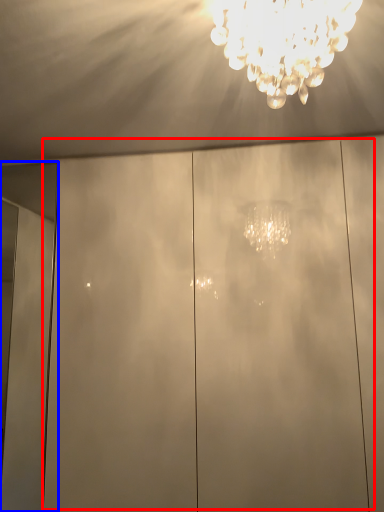
Question: Which point is further to the camera, glass door (highlighted by a red box) or door (highlighted by a blue box)?

Choices:
 (A) glass door
 (B) door

Answer: (B)